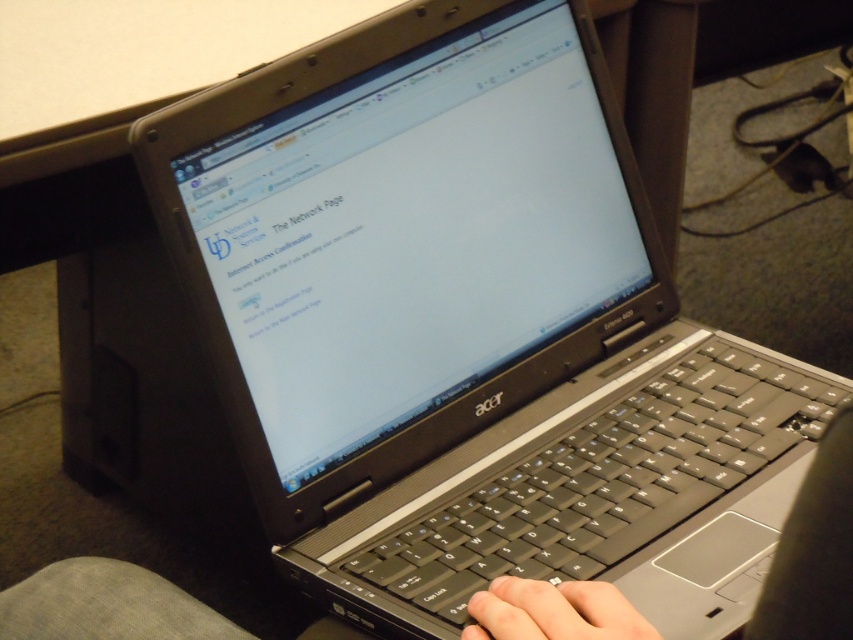
Question: Which of the following is the farthest from the observer?

Choices:
 (A) coord(53,600)
 (B) coord(538,618)

Answer: (A)

Question: Is black matte keyboard at center above skinny white hand at lower center?

Choices:
 (A) no
 (B) yes

Answer: (B)

Question: Which point is closer to the camera?

Choices:
 (A) skinny white hand at lower center
 (B) black matte keyboard at center

Answer: (B)

Question: Does black matte keyboard at center have a smaller size compared to skinny white hand at lower center?

Choices:
 (A) yes
 (B) no

Answer: (B)

Question: Can you confirm if black matte keyboard at center is positioned to the right of skinny white hand at lower center?

Choices:
 (A) yes
 (B) no

Answer: (B)